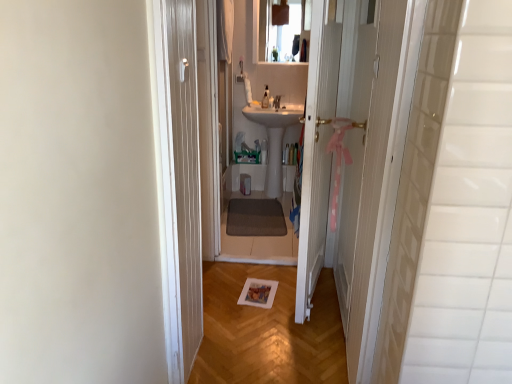
Question: Should I look upward or downward to see pink ribbon at right?

Choices:
 (A) up
 (B) down

Answer: (A)

Question: Can you confirm if pink ribbon at right is smaller than white wooden door at center?

Choices:
 (A) no
 (B) yes

Answer: (B)

Question: Does pink ribbon at right come in front of white wooden door at center?

Choices:
 (A) no
 (B) yes

Answer: (A)

Question: Can you confirm if pink ribbon at right is bigger than white wooden door at center?

Choices:
 (A) yes
 (B) no

Answer: (B)

Question: Is pink ribbon at right thinner than white wooden door at center?

Choices:
 (A) no
 (B) yes

Answer: (B)

Question: Are pink ribbon at right and white wooden door at center far apart?

Choices:
 (A) no
 (B) yes

Answer: (A)

Question: Is the surface of pink ribbon at right in direct contact with white wooden door at center?

Choices:
 (A) yes
 (B) no

Answer: (B)

Question: Does clear glass mirror at upper center have a larger size compared to white wooden door at center?

Choices:
 (A) no
 (B) yes

Answer: (A)

Question: Is clear glass mirror at upper center positioned far away from white wooden door at center?

Choices:
 (A) no
 (B) yes

Answer: (B)

Question: Is the depth of clear glass mirror at upper center greater than that of white wooden door at center?

Choices:
 (A) yes
 (B) no

Answer: (A)

Question: Does clear glass mirror at upper center have a greater width compared to white wooden door at center?

Choices:
 (A) no
 (B) yes

Answer: (A)

Question: Is the position of clear glass mirror at upper center less distant than that of white wooden door at center?

Choices:
 (A) no
 (B) yes

Answer: (A)

Question: Does clear glass mirror at upper center have a lesser width compared to white wooden door at center?

Choices:
 (A) no
 (B) yes

Answer: (B)

Question: Considering the relative sizes of white glossy sink at center and clear glass mirror at upper center in the image provided, is white glossy sink at center wider than clear glass mirror at upper center?

Choices:
 (A) yes
 (B) no

Answer: (A)